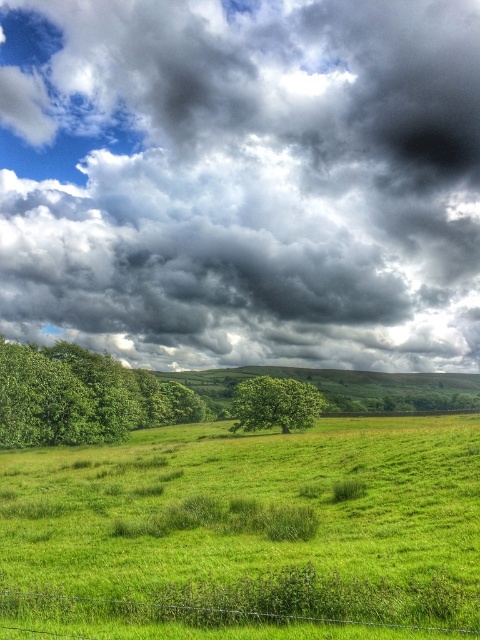
You are a landscape architect designing a new garden. You need to place a 3m tall statue between the green leafy tree at left and the wire mesh fence at lower center. Considering their heights, will the statue be taller than both?

The green leafy tree at left has a greater height compared to the wire mesh fence at lower center. However, since the statue is 3m tall, we need to know the actual heights of both objects to determine if it surpasses them. The provided information only states that the tree is taller than the fence, but doesn not specify their exact heights. Therefore, it is impossible to confirm if the statue will be taller than both based on the given data.

You are an airplane pilot flying over a rural area. You notice a cloudy sky at upper center and a green leafy tree at left in the landscape below. Which object is positioned to the right when looking at the scene from above?

The cloudy sky at upper center is positioned to the right of the green leafy tree at left.

You are a painter standing in the field and want to paint the green leafy tree at left and the wire mesh fence at lower center. Which object should you move closer to first if you want to paint both in detail?

You should move closer to the green leafy tree at left first because it is closer to you than the wire mesh fence at lower center, so you can paint it in detail before moving further away to the fence.